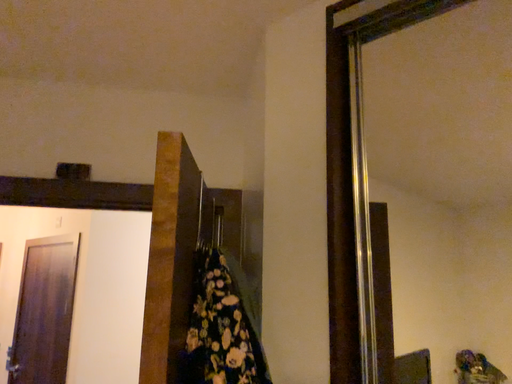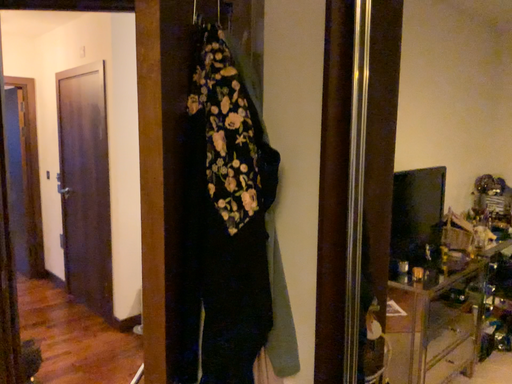
Question: Which way did the camera rotate in the video?

Choices:
 (A) rotated downward
 (B) rotated upward

Answer: (A)